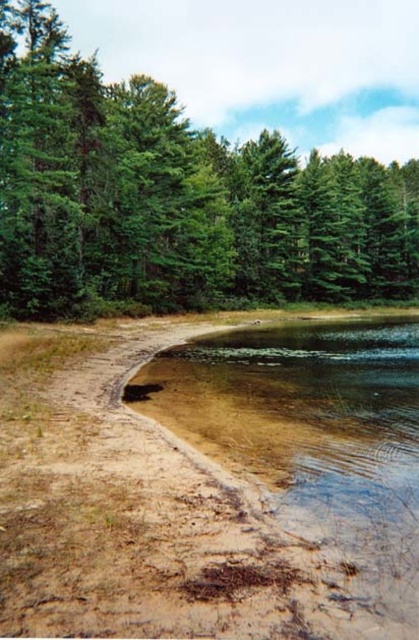
You are standing at the edge of the water and want to walk to the clear sedimentary sand at lower left. Which direction should you head towards, considering the green leafy tree at upper left is blocking your path?

The clear sedimentary sand at lower left is behind the green leafy tree at upper left, so you should walk around the tree to reach it.

Looking at this image, you are planning to plant a new tree in this landscape. The new tree needs to be placed in an area that has enough space. Based on the scene, which area has more width for planting the new tree? Please choose between the green leafy tree at upper left and the clear sedimentary sand at lower left.

The green leafy tree at upper left has a greater width compared to the clear sedimentary sand at lower left, so the area around the green leafy tree at upper left provides more space for planting the new tree.

Consider the image. You are standing at the center of the image and want to walk towards the green leafy tree at upper left. Which direction should you face to head directly towards it?

You should face towards the upper left direction to head directly towards the green leafy tree at upper left, as its 2D location is at point (173,198) which is in the upper left quadrant of the image.